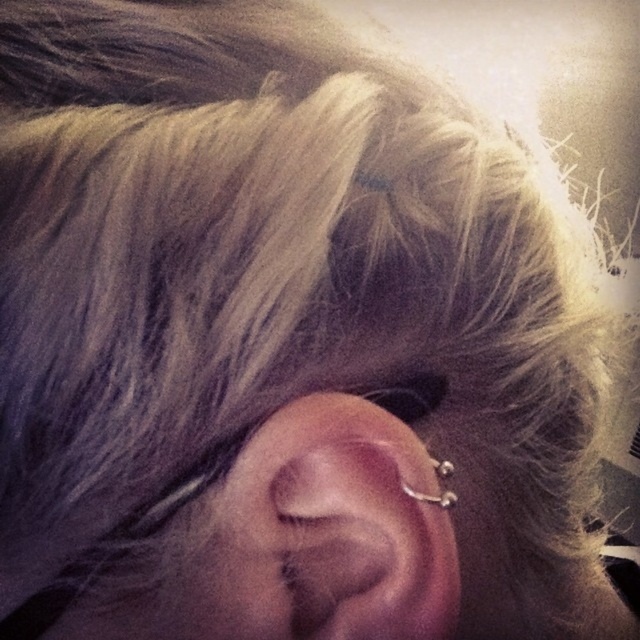
Question: Does silver metallic ear at center come behind silver metallic hoop at ear?

Choices:
 (A) yes
 (B) no

Answer: (B)

Question: Among these points, which one is farthest from the camera?

Choices:
 (A) tap(419, 493)
 (B) tap(305, 520)

Answer: (A)

Question: Which point appears farthest from the camera in this image?

Choices:
 (A) (376, 419)
 (B) (449, 500)

Answer: (B)

Question: From the image, what is the correct spatial relationship of silver metallic ear at center in relation to silver metallic hoop at ear?

Choices:
 (A) left
 (B) right

Answer: (A)

Question: From the image, what is the correct spatial relationship of silver metallic ear at center in relation to silver metallic hoop at ear?

Choices:
 (A) above
 (B) below

Answer: (B)